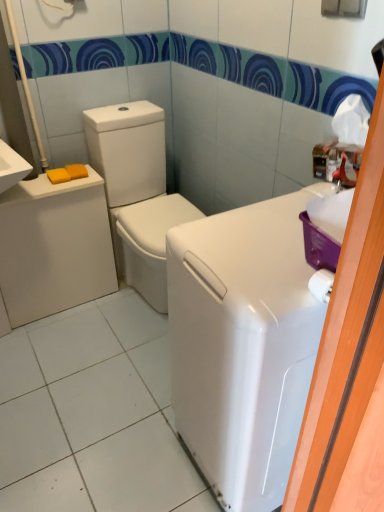
Image resolution: width=384 pixels, height=512 pixels. What are the coordinates of `free space in front of yellow matte soap at left, the 1th soap viewed from the left` in the screenshot? It's located at (49, 187).